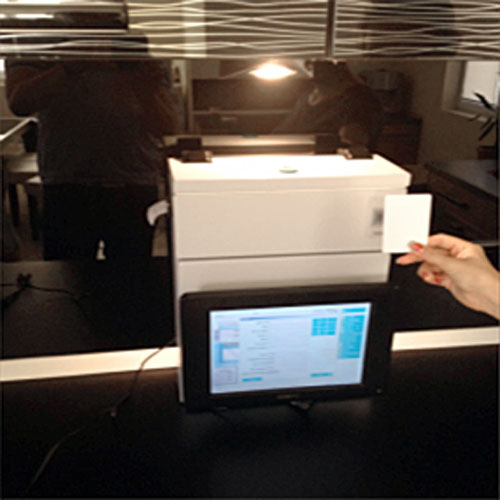
In order to click on cord in this screenshot , I will do `click(140, 376)`.